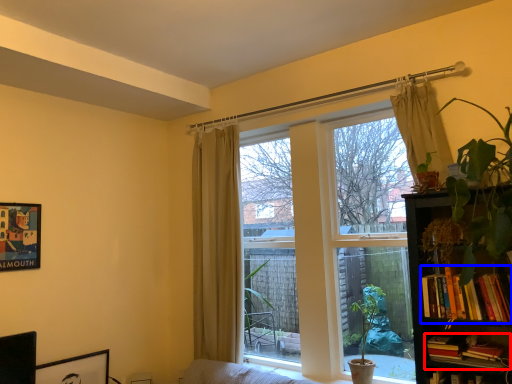
Question: Which of the following is the farthest to the observer, book (highlighted by a red box) or book (highlighted by a blue box)?

Choices:
 (A) book
 (B) book

Answer: (A)